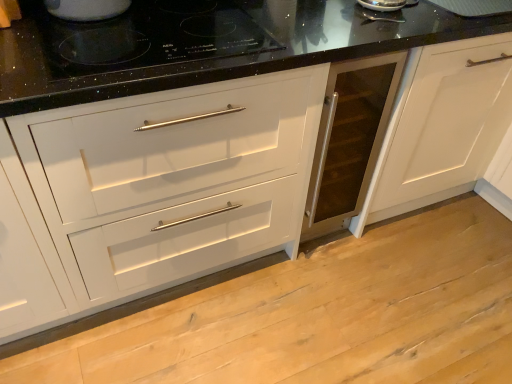
Where is `free location in front of white glossy kettle at upper left`? free location in front of white glossy kettle at upper left is located at coordinates (99, 42).